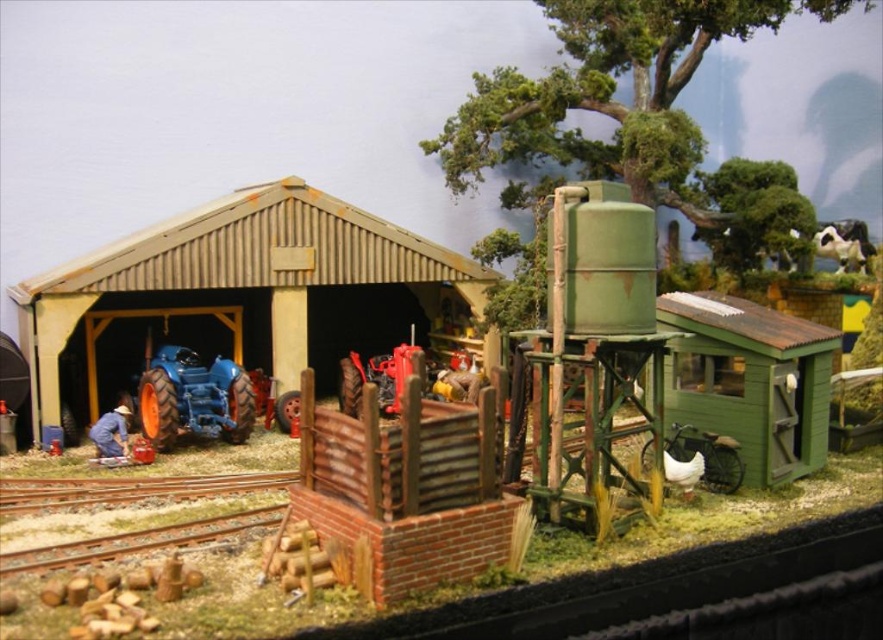
Can you confirm if rusty metal tracks at lower left is positioned above black and white fur at upper right?

Incorrect, rusty metal tracks at lower left is not positioned above black and white fur at upper right.

Identify the location of rusty metal tracks at lower left. (129, 488).

Between rustic wood shed at center and matte blue tractor at center-left, which one appears on the left side from the viewer's perspective?

matte blue tractor at center-left is more to the left.

Who is shorter, rustic wood shed at center or matte blue tractor at center-left?

matte blue tractor at center-left is shorter.

At what (x,y) coordinates should I click in order to perform the action: click on rustic wood shed at center. Please return your answer as a coordinate pair (x, y). The width and height of the screenshot is (883, 640). Looking at the image, I should click on (240, 296).

Between green matte shed at right and green matte water tower at upper right, which one is positioned lower?

green matte shed at right is lower down.

In order to click on green matte shed at right in this screenshot , I will do pos(751,380).